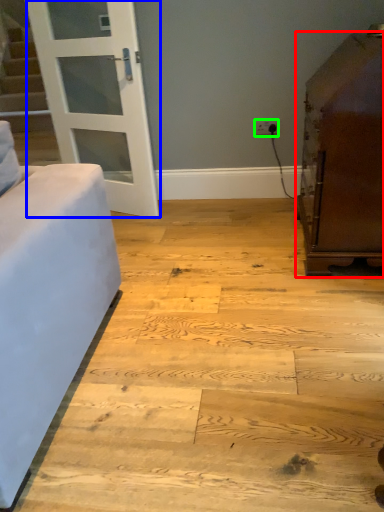
Question: Based on their relative distances, which object is farther from furniture (highlighted by a red box)? Choose from door (highlighted by a blue box) and electric outlet (highlighted by a green box).

Choices:
 (A) door
 (B) electric outlet

Answer: (A)